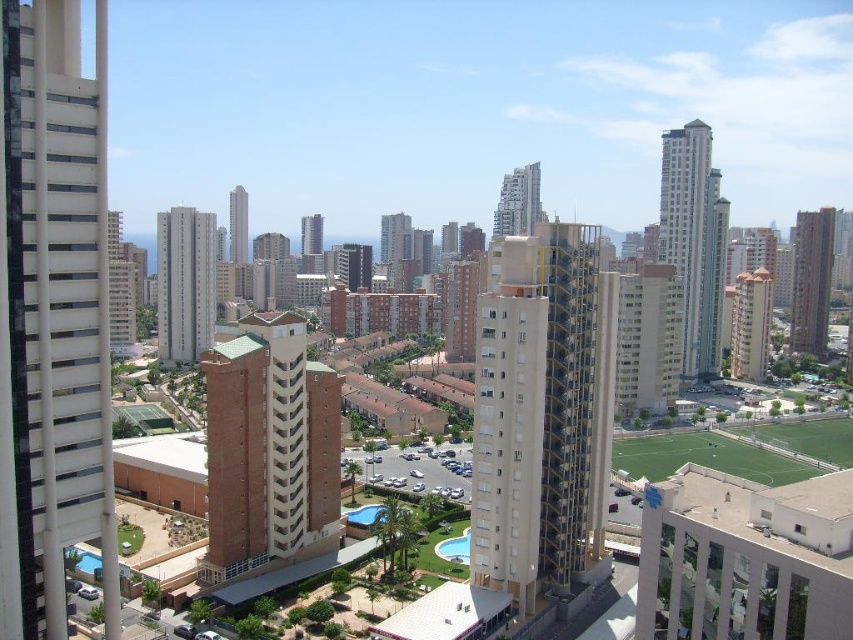
Question: Is light brown brick building at left behind blue glass pool at center?

Choices:
 (A) no
 (B) yes

Answer: (A)

Question: Which of the following is the closest to the observer?

Choices:
 (A) blue glass pool at center
 (B) light beige concrete building at center

Answer: (A)

Question: Which object is closer to the camera taking this photo?

Choices:
 (A) brick textured building at center
 (B) light brown brick building at left
 (C) white textured building at left

Answer: (C)

Question: Is metallic glass skyscraper at center to the right of brick textured building at center from the viewer's perspective?

Choices:
 (A) no
 (B) yes

Answer: (B)

Question: Does glassy teal skyscraper at right have a smaller size compared to metallic glass skyscraper at center?

Choices:
 (A) no
 (B) yes

Answer: (A)

Question: Estimate the real-world distances between objects in this image. Which object is farther from the glassy teal skyscraper at right?

Choices:
 (A) light beige concrete building at center
 (B) brown brick building at center
 (C) white textured building at left
 (D) beige textured building at center

Answer: (C)